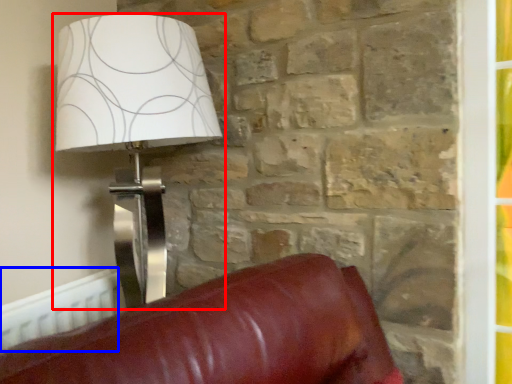
Question: Which object appears farthest to the camera in this image, lamp (highlighted by a red box) or radiator (highlighted by a blue box)?

Choices:
 (A) lamp
 (B) radiator

Answer: (B)